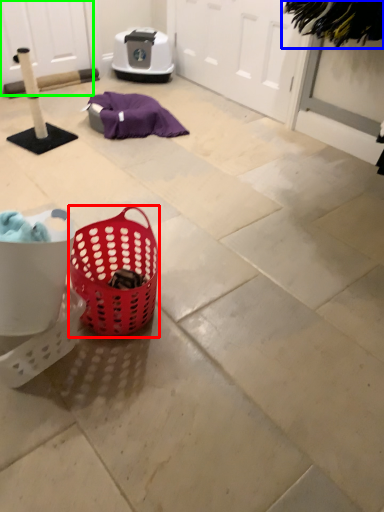
Question: Based on their relative distances, which object is farther from picnic basket (highlighted by a red box)? Choose from clothe (highlighted by a blue box) and screen door (highlighted by a green box).

Choices:
 (A) clothe
 (B) screen door

Answer: (B)